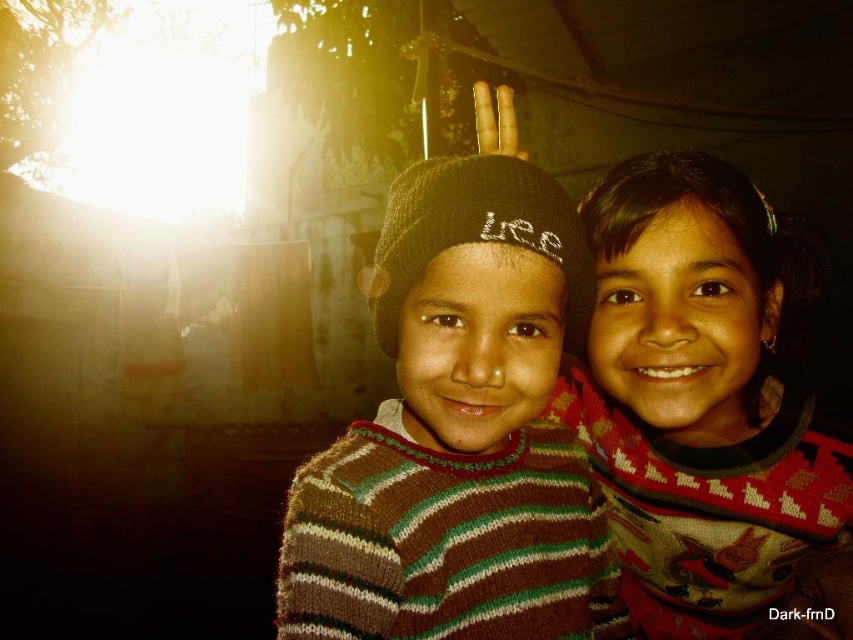
Who is positioned more to the left, knitted striped sweater at center or knitted sweater at center?

From the viewer's perspective, knitted striped sweater at center appears more on the left side.

How much distance is there between knitted striped sweater at center and knitted sweater at center?

knitted striped sweater at center is 21.36 centimeters from knitted sweater at center.

Which is in front, point (537, 429) or point (757, 422)?

Point (537, 429) is more forward.

The image size is (853, 640). Identify the location of knitted striped sweater at center. (459, 433).